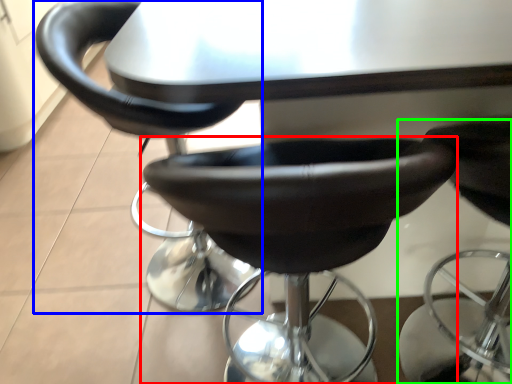
Question: Which is farther away from chair (highlighted by a red box)? chair (highlighted by a blue box) or chair (highlighted by a green box)?

Choices:
 (A) chair
 (B) chair

Answer: (B)